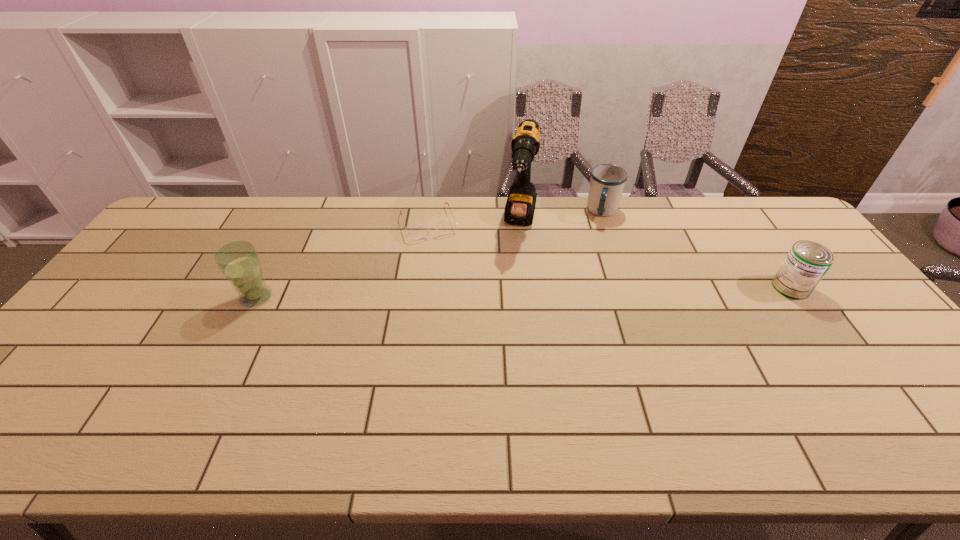
Identify the location of the leftmost object. Image resolution: width=960 pixels, height=540 pixels. (239, 262).

At what (x,y) coordinates should I click in order to perform the action: click on can. Please return your answer as a coordinate pair (x, y). This screenshot has width=960, height=540. Looking at the image, I should click on (807, 262).

Identify the location of the shortest object. (446, 226).

Identify the location of spectacles. Image resolution: width=960 pixels, height=540 pixels. (446, 226).

This screenshot has height=540, width=960. I want to click on the second object from right to left, so click(607, 182).

Where is `drill`? drill is located at coordinates (519, 210).

Where is `the third object from left to right`? The height and width of the screenshot is (540, 960). the third object from left to right is located at coordinates (519, 210).

Image resolution: width=960 pixels, height=540 pixels. What are the coordinates of `free spot located on the back of the glass` in the screenshot? It's located at (295, 221).

Image resolution: width=960 pixels, height=540 pixels. Identify the location of free location located on the front of the can. 811,316.

Locate an element on the screen. free spot located 0.160m on the front-facing side of the spectacles is located at coordinates (447, 273).